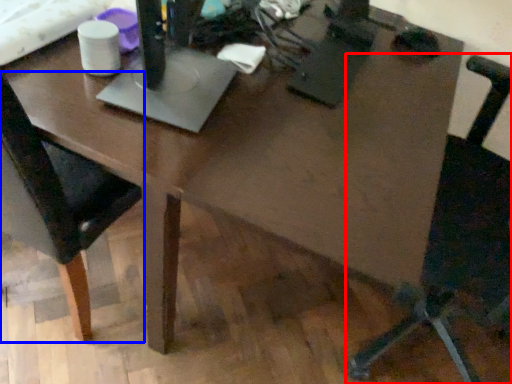
Question: Which object appears closest to the camera in this image, chair (highlighted by a red box) or chair (highlighted by a blue box)?

Choices:
 (A) chair
 (B) chair

Answer: (A)